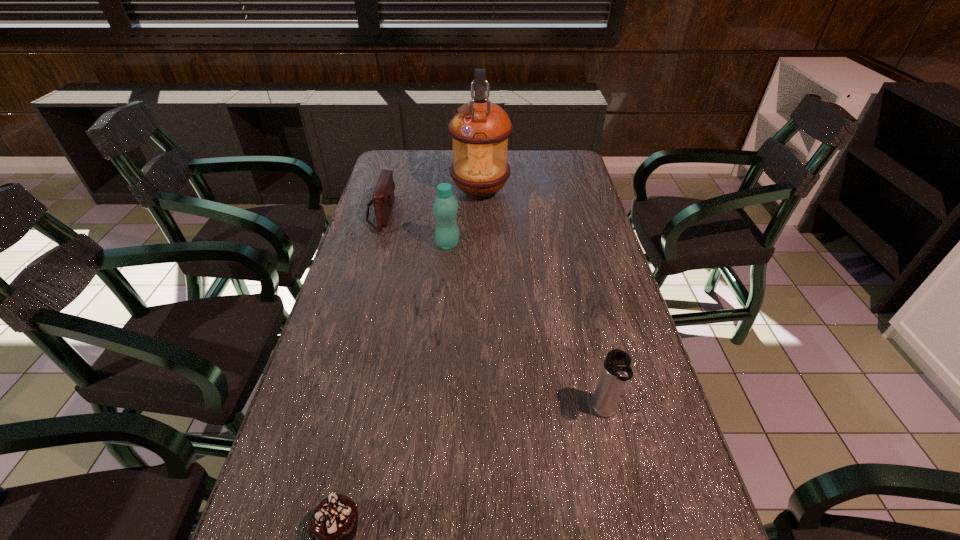
Image resolution: width=960 pixels, height=540 pixels. Identify the location of object that is at the far edge. (479, 129).

Find the location of a particular element. This screenshot has width=960, height=540. object located in the left edge section of the desktop is located at coordinates (383, 198).

Find the location of a particular element. The image size is (960, 540). object that is at the right edge is located at coordinates (616, 370).

The height and width of the screenshot is (540, 960). In the image, there is a desktop. What are the coordinates of `vacant space at the left edge` in the screenshot? It's located at (339, 309).

Locate an element on the screen. vacant space at the right edge is located at coordinates (596, 217).

Where is `unoccupied area between the oil lamp and the shoulder bag`? This screenshot has width=960, height=540. unoccupied area between the oil lamp and the shoulder bag is located at coordinates (431, 202).

The height and width of the screenshot is (540, 960). Find the location of `free area in between the second shortest object and the third nearest object`. free area in between the second shortest object and the third nearest object is located at coordinates (415, 229).

You are a GUI agent. You are given a task and a screenshot of the screen. Output one action in this format:
    pyautogui.click(x=<x>, y=<y>)
    Task: Click on the vacant area that lies between the second shortest object and the oil lamp
    This screenshot has height=540, width=960.
    Given the screenshot: What is the action you would take?
    pyautogui.click(x=431, y=202)

At what (x,y) coordinates should I click in order to perform the action: click on the second closest object to the tallest object. Please return your answer as a coordinate pair (x, y). This screenshot has height=540, width=960. Looking at the image, I should click on pyautogui.click(x=383, y=198).

Locate which object ranks third in proximity to the rightmost object. Please provide its 2D coordinates. Your answer should be formatted as a tuple, i.e. [(x, y)], where the tuple contains the x and y coordinates of a point satisfying the conditions above.

[(479, 129)]